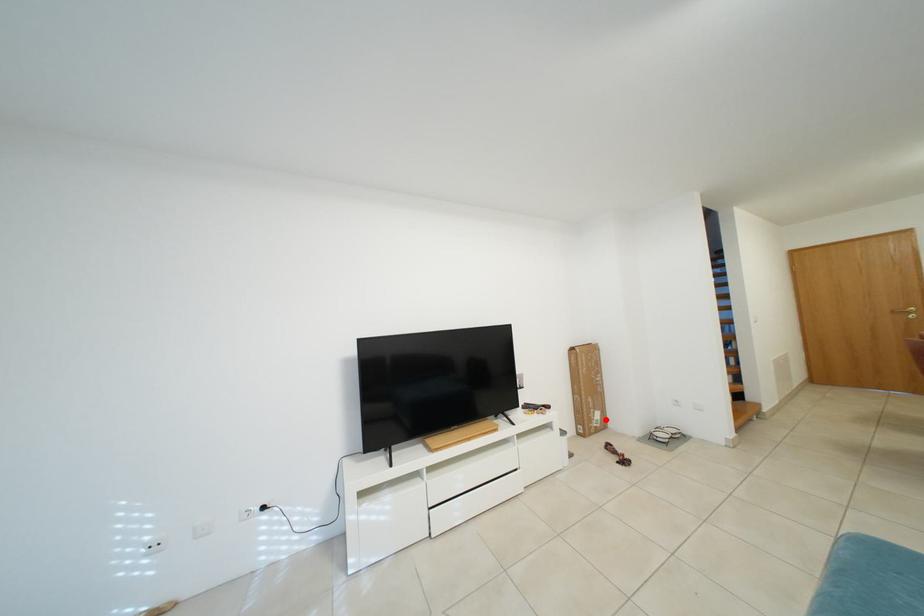
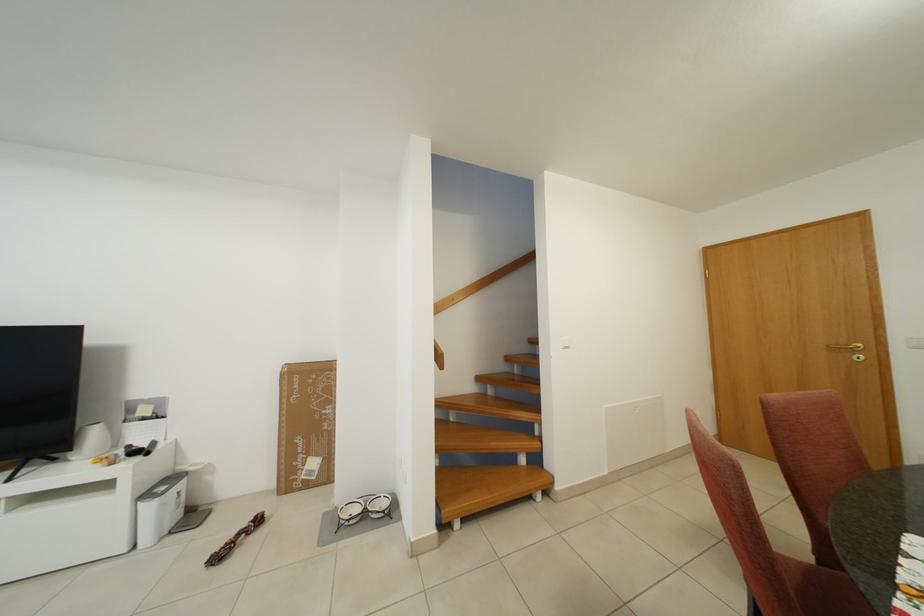
Find the pixel in the second image that matches the highlighted location in the first image.

(322, 468)